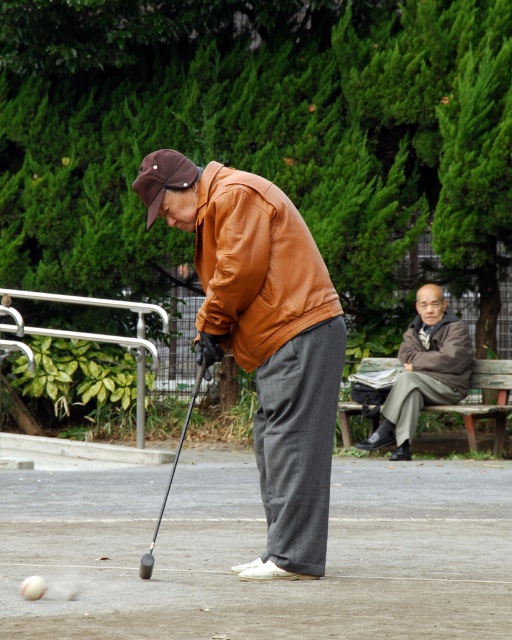
Does point (419, 340) lie in front of point (185, 424)?

Yes, point (419, 340) is in front of point (185, 424).

Can you confirm if brown leather jacket at right is positioned above black rubber golf club at lower center?

Yes, brown leather jacket at right is above black rubber golf club at lower center.

Does point (445, 330) lie behind point (143, 566)?

Yes.

Where is `brown leather jacket at right`? brown leather jacket at right is located at coordinates (440, 352).

Locate an element on the screen. The image size is (512, 640). gray fabric jacket at upper right is located at coordinates (424, 371).

Is point (416, 328) farther from viewer compared to point (27, 593)?

Yes, it is.

Identify the location of gray fabric jacket at upper right. (424, 371).

Who is shorter, black rubber golf club at lower center or white matte golf ball at lower left?

white matte golf ball at lower left

Is black rubber golf club at lower center thinner than white matte golf ball at lower left?

No.

Image resolution: width=512 pixels, height=640 pixels. I want to click on black rubber golf club at lower center, so click(170, 477).

Where is `black rubber golf club at lower center`? black rubber golf club at lower center is located at coordinates (170, 477).